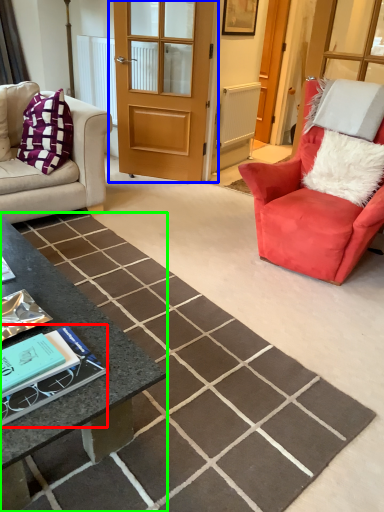
Question: Which is nearer to the book (highlighted by a red box)? door (highlighted by a blue box) or coffee table (highlighted by a green box).

Choices:
 (A) door
 (B) coffee table

Answer: (B)